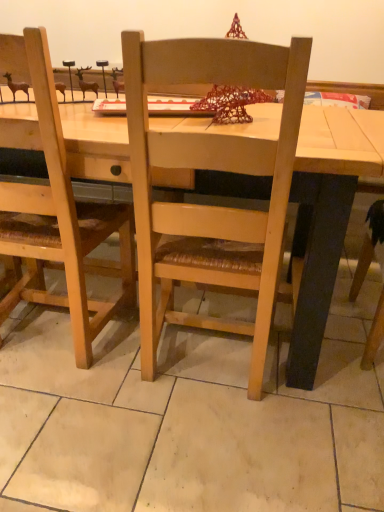
This screenshot has height=512, width=384. Find the location of `free space in front of natural wood chair at center`. free space in front of natural wood chair at center is located at coordinates (203, 451).